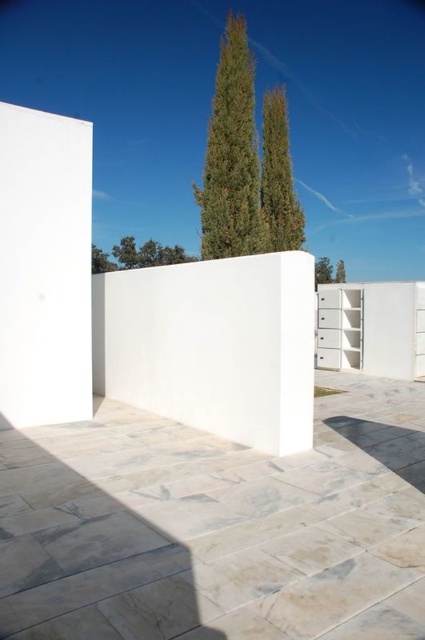
Question: Can you confirm if green textured cypress tree at upper center is thinner than green leafy cypress at upper center?

Choices:
 (A) yes
 (B) no

Answer: (B)

Question: Among these objects, which one is farthest from the camera?

Choices:
 (A) green textured cypress tree at upper center
 (B) green leafy cypress at upper center

Answer: (B)

Question: Which object appears closest to the camera in this image?

Choices:
 (A) green textured cypress tree at upper center
 (B) green leafy cypress at upper center

Answer: (A)

Question: Can you confirm if green textured cypress tree at upper center is positioned below green leafy cypress at upper center?

Choices:
 (A) no
 (B) yes

Answer: (B)

Question: Is green textured cypress tree at upper center closer to the viewer compared to green leafy cypress at upper center?

Choices:
 (A) no
 (B) yes

Answer: (B)